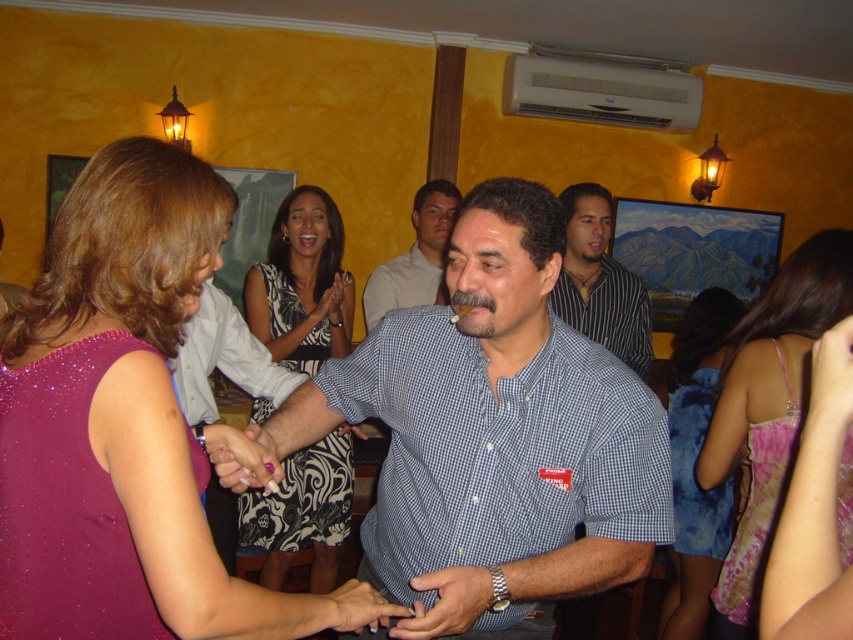
Question: In this image, where is blue checkered shirt at center located relative to checkered shirt at center?

Choices:
 (A) right
 (B) left

Answer: (A)

Question: Is black and white floral dress at center to the left of blue velvet dress at lower right from the viewer's perspective?

Choices:
 (A) yes
 (B) no

Answer: (A)

Question: Among these points, which one is nearest to the camera?

Choices:
 (A) (427, 264)
 (B) (253, 456)
 (C) (584, 289)

Answer: (B)

Question: Observing the image, what is the correct spatial positioning of black and white floral dress at center in reference to smooth skin hand at center?

Choices:
 (A) left
 (B) right

Answer: (A)

Question: Based on their relative distances, which object is farther from the striped shirt at center?

Choices:
 (A) checkered shirt at center
 (B) black and white floral dress at center
 (C) pink satin ring at center

Answer: (C)

Question: Which object appears farthest from the camera in this image?

Choices:
 (A) blue velvet dress at lower right
 (B) blue checkered shirt at center

Answer: (A)